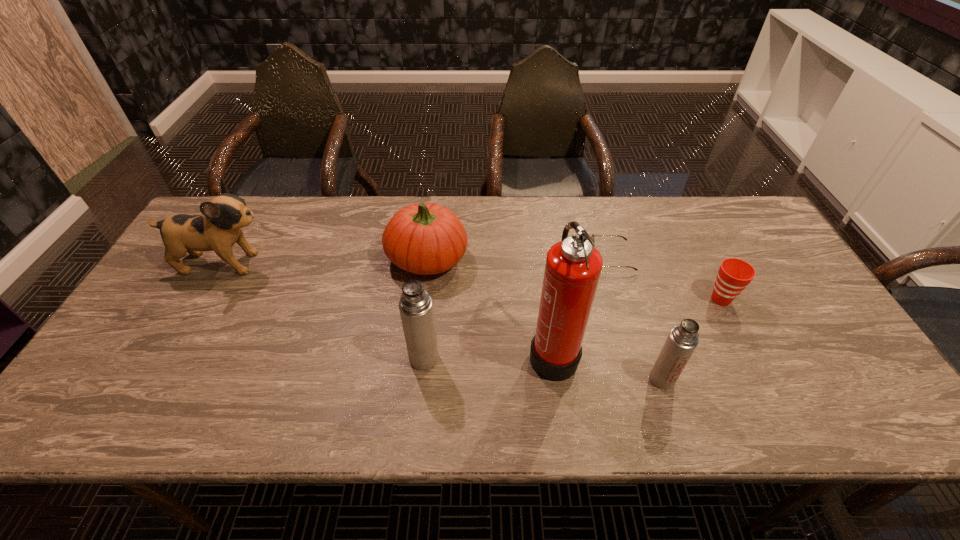
What are the coordinates of `the taller thermos bottle` in the screenshot? It's located at (416, 309).

Where is `the shorter thermos bottle`? This screenshot has width=960, height=540. the shorter thermos bottle is located at coordinates (682, 340).

At what (x,y) coordinates should I click in order to perform the action: click on the leftmost object. Please return your answer as a coordinate pair (x, y). Looking at the image, I should click on (218, 228).

Locate an element on the screen. This screenshot has width=960, height=540. sunglasses is located at coordinates (592, 236).

At what (x,y) coordinates should I click in order to perform the action: click on the fourth nearest object. Please return your answer as a coordinate pair (x, y). Image resolution: width=960 pixels, height=540 pixels. Looking at the image, I should click on (734, 274).

At what (x,y) coordinates should I click in order to perform the action: click on the rightmost object. Please return your answer as a coordinate pair (x, y). Looking at the image, I should click on [x=734, y=274].

Locate an element on the screen. This screenshot has width=960, height=540. pumpkin is located at coordinates (424, 238).

Where is `fire extinguisher`? The height and width of the screenshot is (540, 960). fire extinguisher is located at coordinates (573, 266).

Image resolution: width=960 pixels, height=540 pixels. What are the coordinates of `the tallest object` in the screenshot? It's located at (573, 266).

Where is `free spot located on the back of the left thermos bottle`? free spot located on the back of the left thermos bottle is located at coordinates (434, 261).